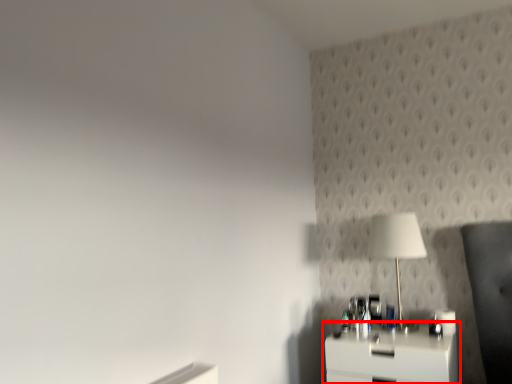
Question: In this image, where is nightstand (annotated by the red box) located relative to table lamp?

Choices:
 (A) right
 (B) left

Answer: (B)